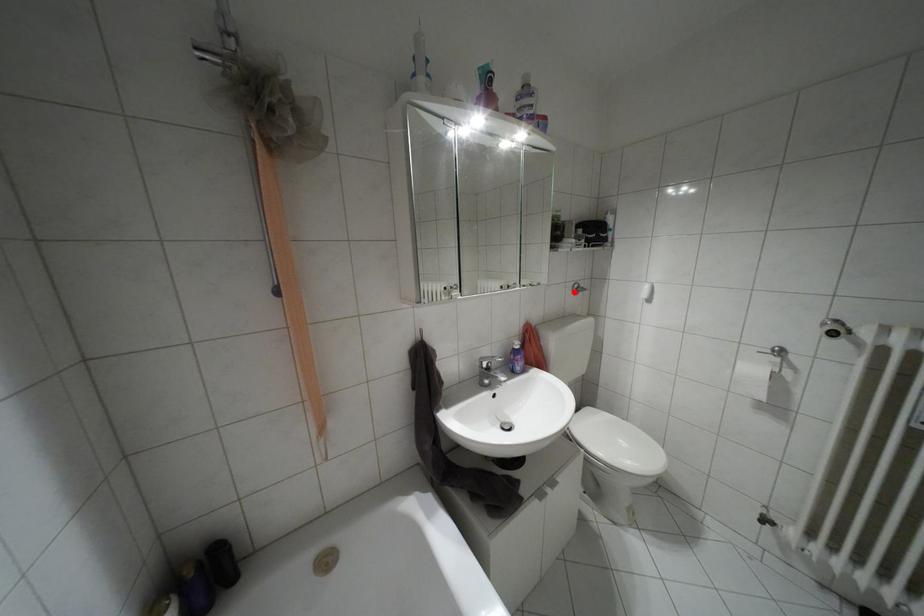
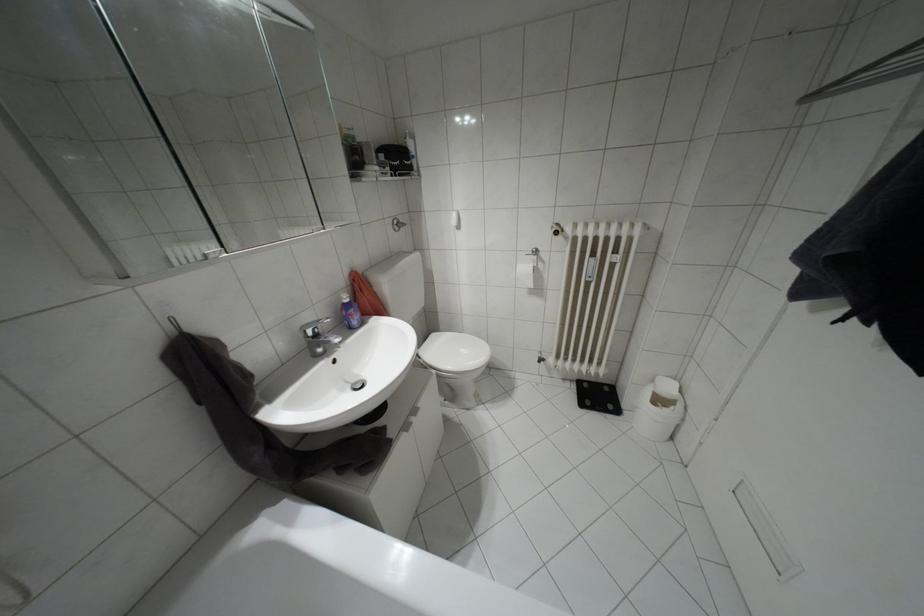
Question: I am providing you with two images of the same scene from different viewpoints. In image1, a red point is highlighted. Considering the same 3D point in image2, which of the following is correct?

Choices:
 (A) It is closer
 (B) It is farther

Answer: (A)